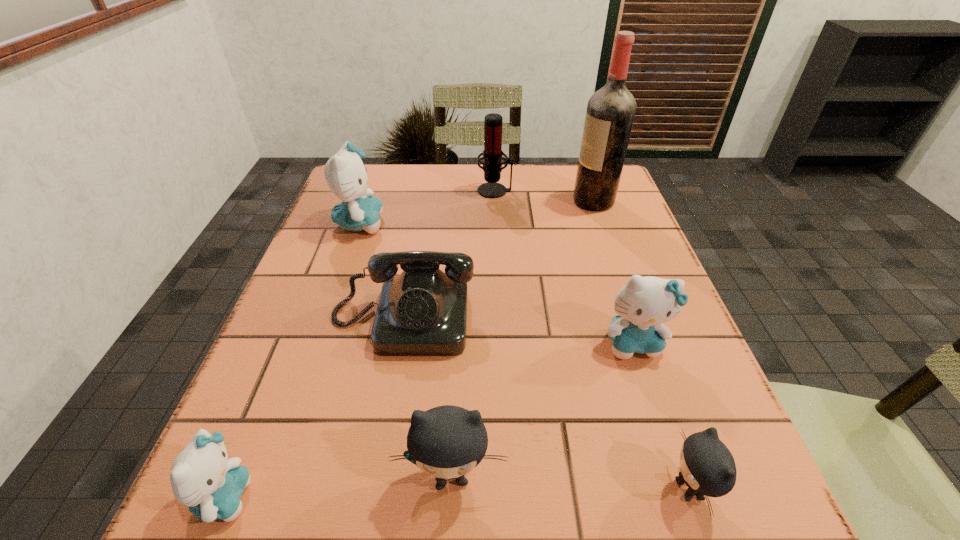
Where is `vacant space located 0.190m on the front-facing side of the smaller gray kitten`? This screenshot has height=540, width=960. vacant space located 0.190m on the front-facing side of the smaller gray kitten is located at coordinates (530, 489).

This screenshot has height=540, width=960. What are the coordinates of `free region located on the front-facing side of the smaller gray kitten` in the screenshot? It's located at (544, 489).

This screenshot has height=540, width=960. What are the coordinates of `liquor that is at the far edge` in the screenshot? It's located at (610, 113).

Locate an element on the screen. The width and height of the screenshot is (960, 540). microphone at the far edge is located at coordinates (492, 152).

Identify the location of kitten situated at the far edge. This screenshot has height=540, width=960. (345, 174).

Where is `telephone that is at the left edge`? This screenshot has width=960, height=540. telephone that is at the left edge is located at coordinates (422, 312).

What are the coordinates of `liquor that is at the right edge` in the screenshot? It's located at (610, 113).

Find the location of a particular element. Image resolution: width=960 pixels, height=540 pixels. object that is at the far left corner is located at coordinates tap(345, 174).

Where is `object that is at the near left corner`? This screenshot has width=960, height=540. object that is at the near left corner is located at coordinates (202, 477).

The width and height of the screenshot is (960, 540). I want to click on object that is at the far right corner, so click(x=610, y=113).